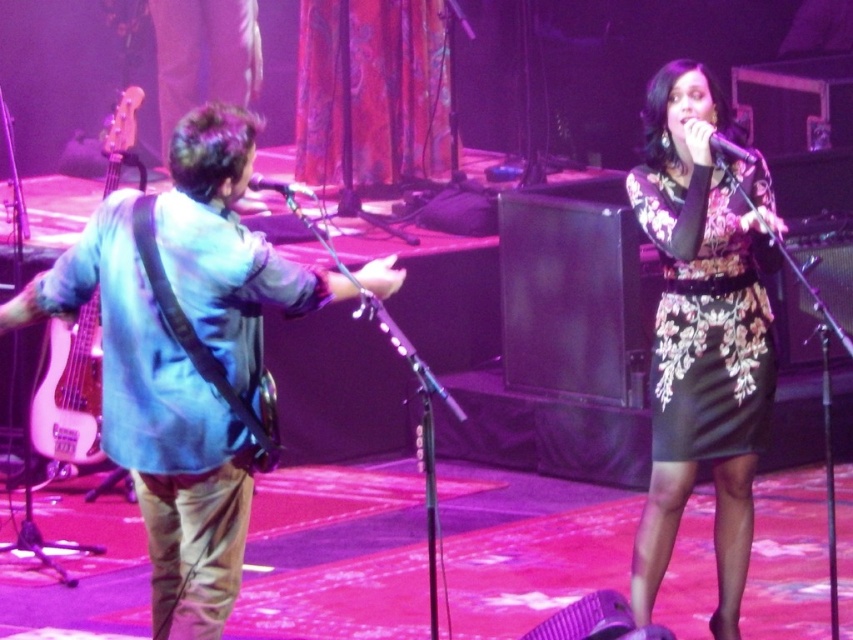
Question: Which object appears closest to the camera in this image?

Choices:
 (A) blue fabric shirt at left
 (B) pink glossy bass guitar at left
 (C) black glossy microphone at upper center
 (D) black floral dress at center

Answer: (A)

Question: Among these points, which one is nearest to the camera?

Choices:
 (A) [257, 291]
 (B) [268, 188]
 (C) [721, 228]
 (D) [115, 179]

Answer: (A)

Question: Which of the following is the closest to the observer?

Choices:
 (A) (300, 188)
 (B) (91, 353)

Answer: (A)

Question: Where is black floral dress at center located in relation to pink glossy bass guitar at left in the image?

Choices:
 (A) above
 (B) below

Answer: (A)

Question: Does metallic silver microphone at center appear on the left side of black glossy microphone at upper center?

Choices:
 (A) yes
 (B) no

Answer: (A)

Question: Is blue fabric shirt at left to the right of black glossy microphone at upper center from the viewer's perspective?

Choices:
 (A) yes
 (B) no

Answer: (B)